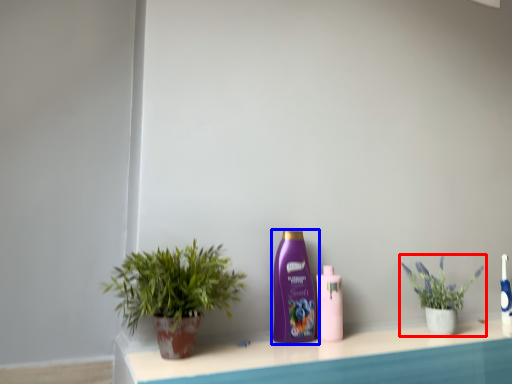
Question: Which object is closer to the camera taking this photo, houseplant (highlighted by a red box) or bottle (highlighted by a blue box)?

Choices:
 (A) houseplant
 (B) bottle

Answer: (B)